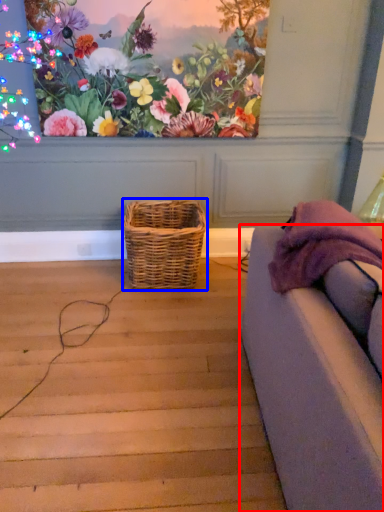
Question: Which of the following is the closest to the observer, studio couch (highlighted by a red box) or picnic basket (highlighted by a blue box)?

Choices:
 (A) studio couch
 (B) picnic basket

Answer: (A)